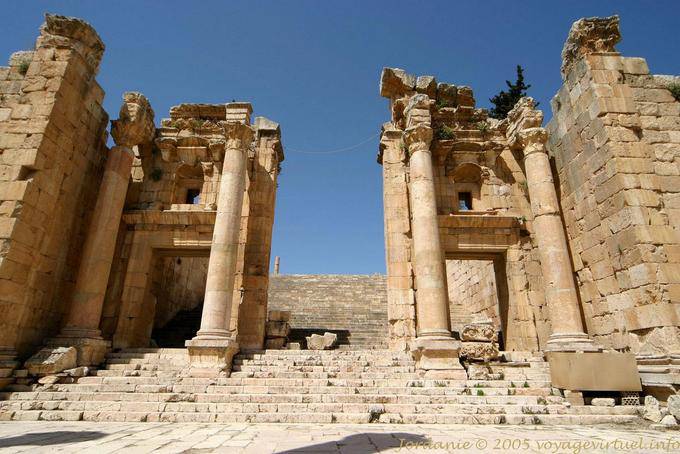
This screenshot has width=680, height=454. What are the coordinates of `stairs` in the screenshot? It's located at (302, 377).